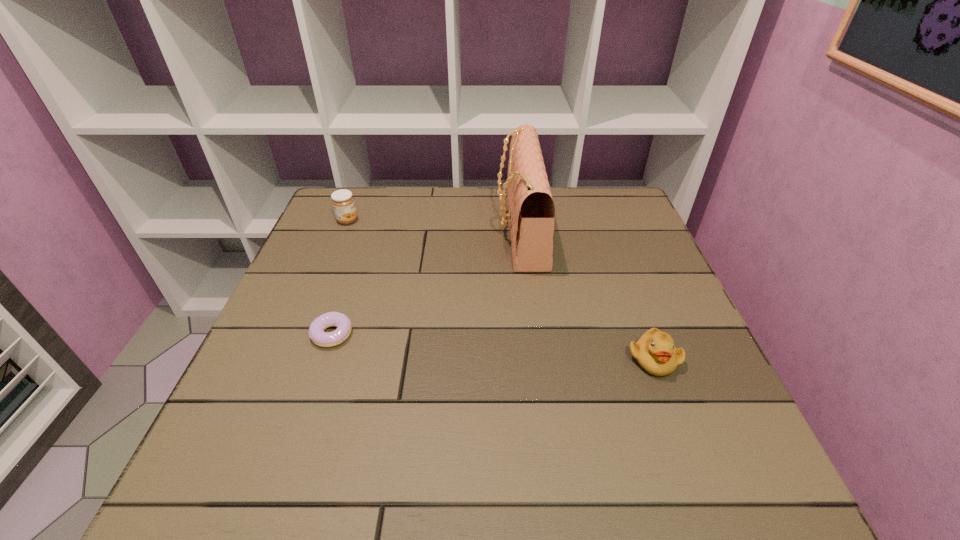
You are a GUI agent. You are given a task and a screenshot of the screen. Output one action in this format:
    pyautogui.click(x=<x>, y=<y>)
    Task: Click on the handbag
    The width and height of the screenshot is (960, 540).
    Given the screenshot: What is the action you would take?
    pyautogui.click(x=531, y=208)

Find the location of `the tallest object`. the tallest object is located at coordinates (531, 208).

At what (x,y) coordinates should I click in order to perform the action: click on jam. Please return your answer as a coordinate pair (x, y). Image resolution: width=960 pixels, height=540 pixels. Looking at the image, I should click on (343, 203).

Find the location of a particular element. The image size is (960, 540). the rightmost object is located at coordinates (655, 352).

I want to click on the shortest object, so click(x=316, y=333).

I want to click on free region located 0.090m on the front-facing side of the third object from left to right, so click(x=464, y=230).

Find the location of a particular element. The height and width of the screenshot is (540, 960). vacant region located on the front-facing side of the third object from left to right is located at coordinates (352, 230).

Identify the location of vacant space located 0.380m on the front-facing side of the third object from left to right. (356, 230).

Find the location of `vacant space located 0.110m on the front label of the jam`. vacant space located 0.110m on the front label of the jam is located at coordinates (397, 220).

Where is `free location located on the front-facing side of the duckling`? free location located on the front-facing side of the duckling is located at coordinates (671, 408).